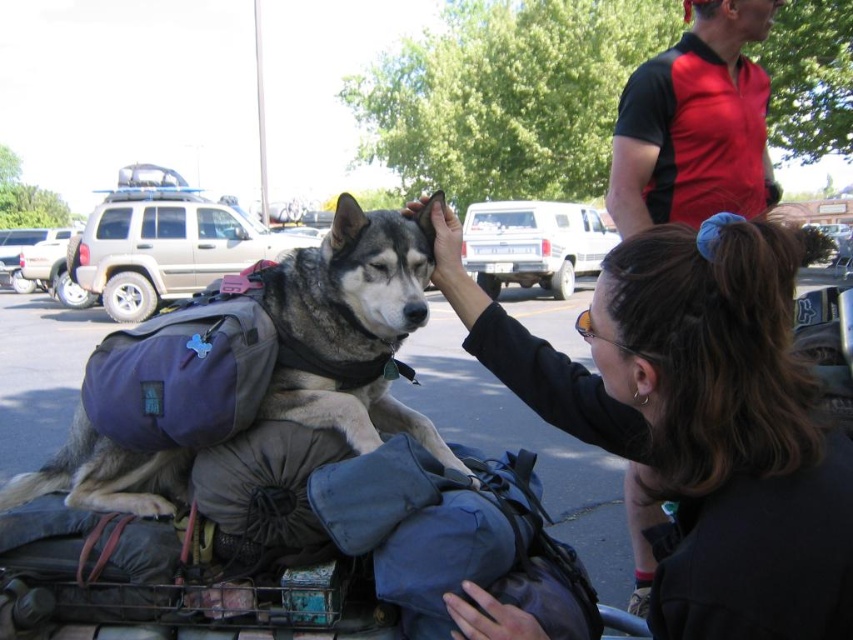
Is dark brown hair at center closer to camera compared to red/black polo shirt at upper right?

Yes.

Is dark brown hair at center positioned behind red/black polo shirt at upper right?

No, dark brown hair at center is in front of red/black polo shirt at upper right.

Image resolution: width=853 pixels, height=640 pixels. What do you see at coordinates (697, 422) in the screenshot?
I see `dark brown hair at center` at bounding box center [697, 422].

Find the location of a particular element. dark brown hair at center is located at coordinates (697, 422).

Which is behind, point (682, 260) or point (103, 484)?

The point (103, 484) is more distant.

Can you confirm if dark brown hair at center is taller than gray-furred backpack at left?

Yes, dark brown hair at center is taller than gray-furred backpack at left.

Who is more distant from viewer, (703, 292) or (315, 260)?

The point (315, 260) is more distant.

This screenshot has width=853, height=640. I want to click on dark brown hair at center, so click(697, 422).

Measure the distance between gray-furred backpack at left and red/black polo shirt at upper right.

gray-furred backpack at left is 1.02 meters away from red/black polo shirt at upper right.

Based on the photo, between gray-furred backpack at left and red/black polo shirt at upper right, which one is positioned higher?

red/black polo shirt at upper right

Locate an element on the screen. gray-furred backpack at left is located at coordinates (352, 324).